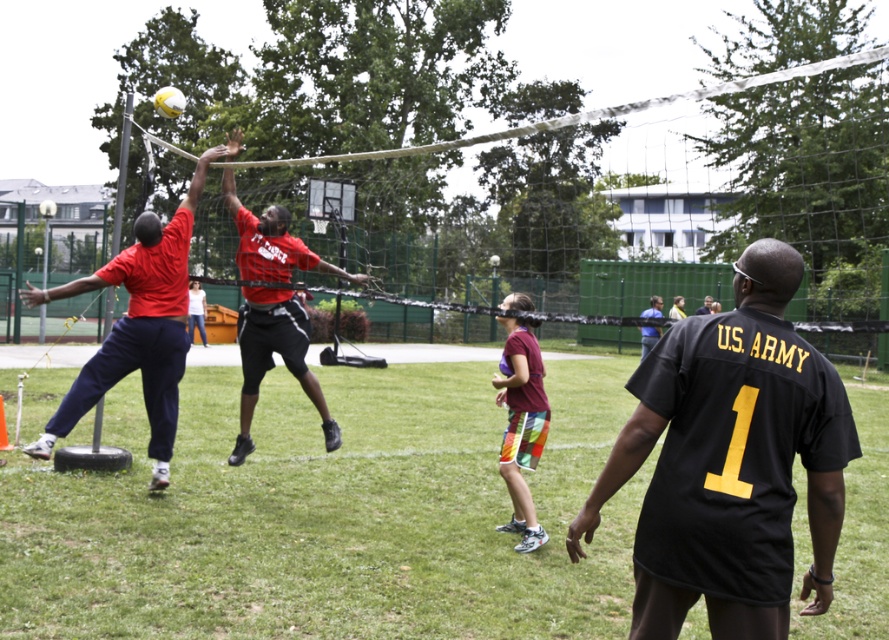
Is matte red shirt at center to the right of yellow matte volleyball at upper center from the viewer's perspective?

Indeed, matte red shirt at center is positioned on the right side of yellow matte volleyball at upper center.

Is point (151, 413) farther from camera compared to point (156, 112)?

That is False.

Between point (154, 230) and point (167, 109), which one is positioned in front?

Point (154, 230)

This screenshot has height=640, width=889. Identify the location of matte red shirt at center. tap(137, 326).

Does black matte jersey at center have a greater width compared to maroon fabric shorts at center?

Yes.

Does black matte jersey at center have a lesser width compared to maroon fabric shorts at center?

No, black matte jersey at center is not thinner than maroon fabric shorts at center.

Where is `black matte jersey at center`? This screenshot has width=889, height=640. black matte jersey at center is located at coordinates (730, 461).

The height and width of the screenshot is (640, 889). I want to click on black matte jersey at center, so click(x=730, y=461).

Can you confirm if red matte shirt at center is taller than black jersey at center?

Correct, red matte shirt at center is much taller as black jersey at center.

Is point (287, 332) less distant than point (703, 310)?

Yes, it is.

The height and width of the screenshot is (640, 889). In order to click on red matte shirt at center in this screenshot , I will do 271,356.